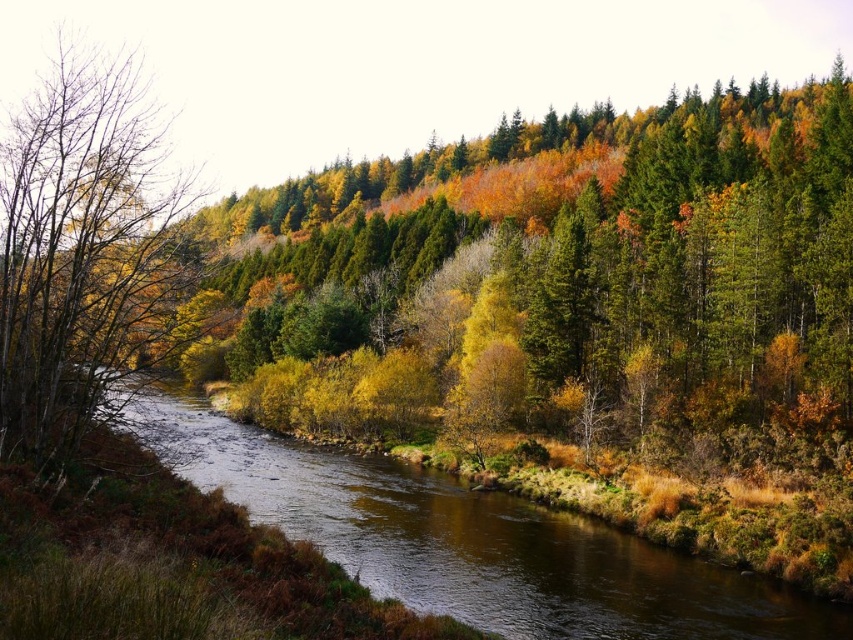
Question: Observing the image, what is the correct spatial positioning of brown smooth stream at center in reference to brown matte tree at left?

Choices:
 (A) above
 (B) below

Answer: (B)

Question: Can you confirm if brown smooth stream at center is thinner than brown matte tree at left?

Choices:
 (A) yes
 (B) no

Answer: (B)

Question: Which of the following is the farthest from the observer?

Choices:
 (A) brown matte tree at left
 (B) brown smooth stream at center

Answer: (B)

Question: Which point is closer to the camera?

Choices:
 (A) (96, 204)
 (B) (199, 397)

Answer: (A)

Question: Does brown smooth stream at center lie behind brown matte tree at left?

Choices:
 (A) no
 (B) yes

Answer: (B)

Question: Which point is closer to the camera?

Choices:
 (A) (190, 195)
 (B) (167, 449)

Answer: (B)